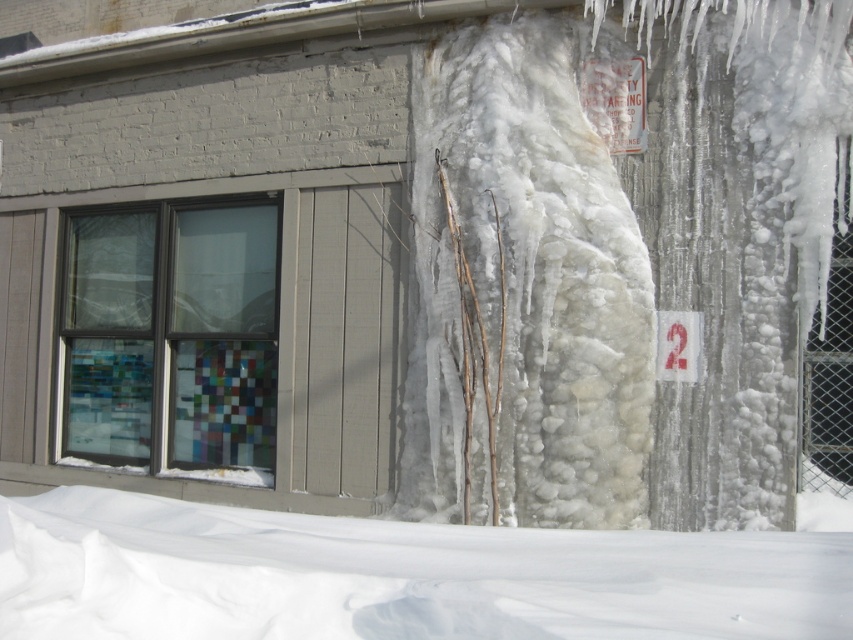
Question: In this image, where is translucent ice at center located relative to white fluffy snow at lower center?

Choices:
 (A) right
 (B) left

Answer: (A)

Question: Which point is closer to the camera?

Choices:
 (A) (599, 513)
 (B) (770, 548)

Answer: (B)

Question: Considering the relative positions of translucent ice at center and white fluffy snow at lower center in the image provided, where is translucent ice at center located with respect to white fluffy snow at lower center?

Choices:
 (A) above
 (B) below

Answer: (A)

Question: Can you confirm if translucent ice at center is wider than white fluffy snow at lower center?

Choices:
 (A) yes
 (B) no

Answer: (B)

Question: Which object is farther from the camera taking this photo?

Choices:
 (A) white fluffy snow at lower center
 (B) translucent ice at center

Answer: (B)